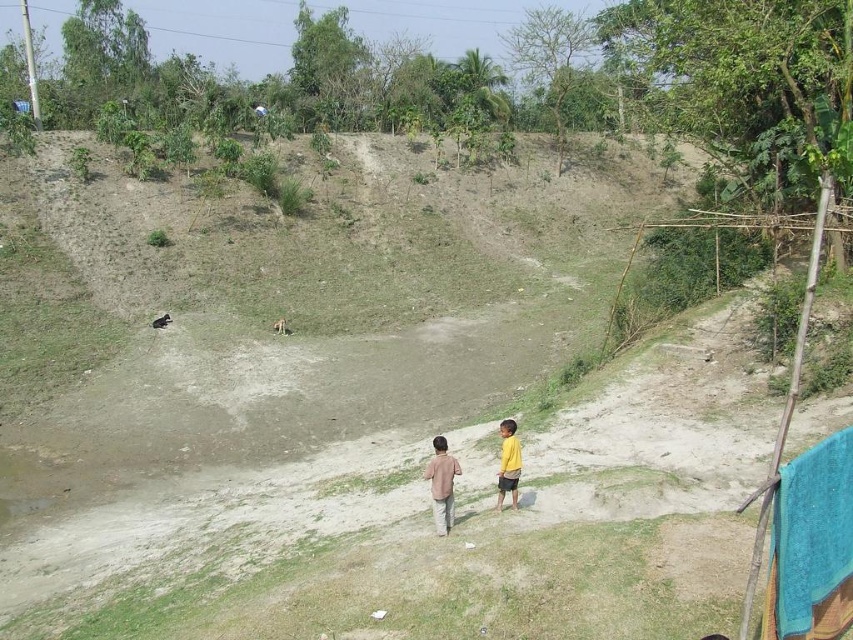
Between light brown cotton shirt at center and yellow matte shirt at lower right, which one is positioned higher?

yellow matte shirt at lower right

Is light brown cotton shirt at center thinner than yellow matte shirt at lower right?

In fact, light brown cotton shirt at center might be wider than yellow matte shirt at lower right.

Where is `light brown cotton shirt at center`? This screenshot has width=853, height=640. light brown cotton shirt at center is located at coordinates (440, 484).

Does brown cotton shirt at center have a greater width compared to yellow matte shirt at lower right?

Correct, the width of brown cotton shirt at center exceeds that of yellow matte shirt at lower right.

Who is more distant from viewer, (440, 515) or (503, 484)?

The point (503, 484) is behind.

Identify the location of brown cotton shirt at center. Image resolution: width=853 pixels, height=640 pixels. (442, 484).

Between point (451, 500) and point (445, 531), which one is positioned in front?

Point (445, 531)

Can you confirm if brown cotton shirt at center is bigger than light brown cotton shirt at center?

Actually, brown cotton shirt at center might be smaller than light brown cotton shirt at center.

Which is in front, point (444, 490) or point (439, 518)?

Point (444, 490) is in front.

The height and width of the screenshot is (640, 853). I want to click on brown cotton shirt at center, so click(x=442, y=484).